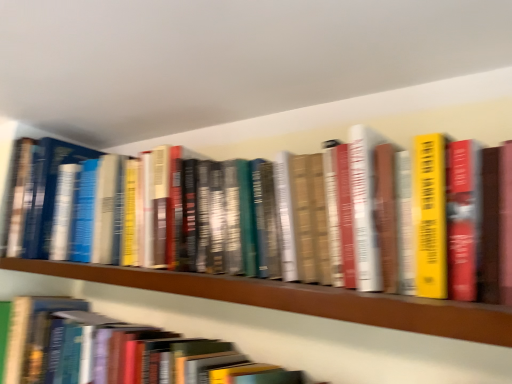
What is the approximate height of hardcover book at lower left?

The height of hardcover book at lower left is 23.21 centimeters.

In order to face hardcover book at lower left, should I rotate leftwards or rightwards?

You should rotate left by 16.559 degrees.

Locate an element on the screen. This screenshot has height=384, width=512. hardcover book at lower left is located at coordinates (117, 351).

This screenshot has height=384, width=512. What do you see at coordinates (117, 351) in the screenshot?
I see `hardcover book at lower left` at bounding box center [117, 351].

What do you see at coordinates (301, 299) in the screenshot? Image resolution: width=512 pixels, height=384 pixels. I see `wooden shelf at center` at bounding box center [301, 299].

What is the approximate height of wooden shelf at center?

It is 2.85 inches.

In order to face wooden shelf at center, should I rotate leftwards or rightwards?

You should look left and rotate roughly 11.146 degrees.

You are a GUI agent. You are given a task and a screenshot of the screen. Output one action in this format:
    pyautogui.click(x=<x>, y=<y>)
    Task: Click on the wooden shelf at center
    Image resolution: width=512 pixels, height=384 pixels.
    Given the screenshot: What is the action you would take?
    pyautogui.click(x=301, y=299)

Find the location of a particular element. The image size is (512, 384). hardcover book at lower left is located at coordinates (117, 351).

Looking at this image, which is more to the right, hardcover book at lower left or wooden shelf at center?

wooden shelf at center.

Who is more distant, hardcover book at lower left or wooden shelf at center?

hardcover book at lower left is more distant.

Considering the points (274, 377) and (233, 293), which point is in front, point (274, 377) or point (233, 293)?

The point (233, 293) is more forward.

From the image's perspective, which is above, hardcover book at lower left or wooden shelf at center?

wooden shelf at center.

From a real-world perspective, is hardcover book at lower left over wooden shelf at center?

Incorrect, from a real-world perspective, hardcover book at lower left is lower than wooden shelf at center.

Is hardcover book at lower left wider than wooden shelf at center?

No.

In terms of height, does hardcover book at lower left look taller or shorter compared to wooden shelf at center?

Clearly, hardcover book at lower left is taller compared to wooden shelf at center.

Who is bigger, hardcover book at lower left or wooden shelf at center?

hardcover book at lower left.

Is hardcover book at lower left located outside wooden shelf at center?

Yes, hardcover book at lower left is located beyond the bounds of wooden shelf at center.

Is hardcover book at lower left far away from wooden shelf at center?

hardcover book at lower left is actually quite close to wooden shelf at center.

Could you tell me if hardcover book at lower left is turned towards wooden shelf at center?

No, hardcover book at lower left is not aimed at wooden shelf at center.

How many degrees apart are the facing directions of hardcover book at lower left and wooden shelf at center?

The angular difference between hardcover book at lower left and wooden shelf at center is 0.355 degrees.

There is a hardcover book at lower left. Identify the location of shelf above it (from a real-world perspective). The image size is (512, 384). (301, 299).

Which object is positioned more to the right, wooden shelf at center or hardcover book at lower left?

wooden shelf at center.

Which object is more forward, wooden shelf at center or hardcover book at lower left?

Positioned in front is wooden shelf at center.

Which point is more distant from viewer, [332,309] or [231,346]?

Point [231,346]

From the image's perspective, which is below, wooden shelf at center or hardcover book at lower left?

hardcover book at lower left appears lower in the image.

From a real-world perspective, is wooden shelf at center under hardcover book at lower left?

No, from a real-world perspective, wooden shelf at center is not beneath hardcover book at lower left.

Consider the image. Does wooden shelf at center have a lesser width compared to hardcover book at lower left?

In fact, wooden shelf at center might be wider than hardcover book at lower left.

From the picture: Who is shorter, wooden shelf at center or hardcover book at lower left?

wooden shelf at center.

Who is bigger, wooden shelf at center or hardcover book at lower left?

hardcover book at lower left is bigger.

Is wooden shelf at center surrounding hardcover book at lower left?

No, hardcover book at lower left is not surrounded by wooden shelf at center.

Looking at this image, is wooden shelf at center next to hardcover book at lower left and touching it?

wooden shelf at center and hardcover book at lower left are clearly separated.

Could you tell me if wooden shelf at center is facing hardcover book at lower left?

No, wooden shelf at center is not aimed at hardcover book at lower left.

How different are the orientations of wooden shelf at center and hardcover book at lower left in degrees?

The angular difference between wooden shelf at center and hardcover book at lower left is 0.355 degrees.

Locate an element on the screen. book located underneath the wooden shelf at center (from a real-world perspective) is located at coordinates (117, 351).

In order to click on shelf above the hardcover book at lower left (from the image's perspective) in this screenshot , I will do `click(301, 299)`.

Locate an element on the screen. shelf above the hardcover book at lower left (from a real-world perspective) is located at coordinates (301, 299).